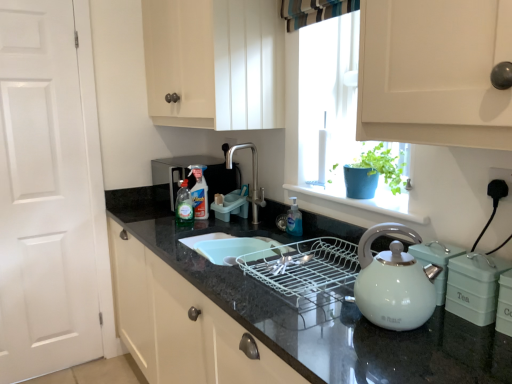
Question: Considering the relative sizes of polished stainless steel faucet at center and black plastic plug at lower right in the image provided, is polished stainless steel faucet at center wider than black plastic plug at lower right?

Choices:
 (A) yes
 (B) no

Answer: (A)

Question: Can you confirm if polished stainless steel faucet at center is positioned to the right of black plastic plug at lower right?

Choices:
 (A) yes
 (B) no

Answer: (B)

Question: Does polished stainless steel faucet at center lie behind black plastic plug at lower right?

Choices:
 (A) yes
 (B) no

Answer: (A)

Question: Is polished stainless steel faucet at center facing away from black plastic plug at lower right?

Choices:
 (A) no
 (B) yes

Answer: (A)

Question: Can black plastic plug at lower right be found inside polished stainless steel faucet at center?

Choices:
 (A) yes
 (B) no

Answer: (B)

Question: Does point (453, 375) appear closer or farther from the camera than point (203, 203)?

Choices:
 (A) closer
 (B) farther

Answer: (A)

Question: Considering the positions of black granite countertop at center and clear plastic bottle at center, the third bottle from the front, in the image, is black granite countertop at center taller or shorter than clear plastic bottle at center, the third bottle from the front,?

Choices:
 (A) short
 (B) tall

Answer: (B)

Question: Is black granite countertop at center bigger or smaller than clear plastic bottle at center, the second bottle in the right-to-left sequence?

Choices:
 (A) big
 (B) small

Answer: (A)

Question: Choose the correct answer: Is black granite countertop at center inside clear plastic bottle at center, which appears as the 1th bottle when viewed from the back, or outside it?

Choices:
 (A) outside
 (B) inside

Answer: (A)

Question: Considering the positions of clear plastic bottle at center, the third bottle from the front, and black granite countertop at center in the image, is clear plastic bottle at center, the third bottle from the front, taller or shorter than black granite countertop at center?

Choices:
 (A) short
 (B) tall

Answer: (A)

Question: In terms of size, does clear plastic bottle at center, arranged as the second bottle when viewed from the left, appear bigger or smaller than black granite countertop at center?

Choices:
 (A) big
 (B) small

Answer: (B)

Question: Considering the positions of point (197, 180) and point (326, 304), is point (197, 180) closer or farther from the camera than point (326, 304)?

Choices:
 (A) farther
 (B) closer

Answer: (A)

Question: From the image's perspective, is clear plastic bottle at center, the second bottle in the right-to-left sequence, above or below black granite countertop at center?

Choices:
 (A) below
 (B) above

Answer: (B)

Question: From their relative heights in the image, would you say blue matte pot at window is taller or shorter than translucent plastic bottle at center, arranged as the 3th bottle when viewed from the right?

Choices:
 (A) tall
 (B) short

Answer: (A)

Question: Is blue matte pot at window inside or outside of translucent plastic bottle at center, which appears as the first bottle when viewed from the left?

Choices:
 (A) inside
 (B) outside

Answer: (B)